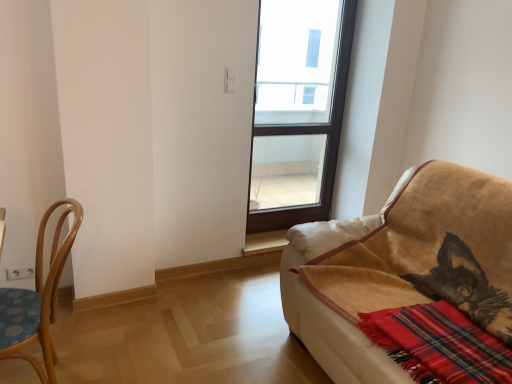
Where is `unoccupied area behind light brown wood chair at left`? The height and width of the screenshot is (384, 512). unoccupied area behind light brown wood chair at left is located at coordinates (102, 340).